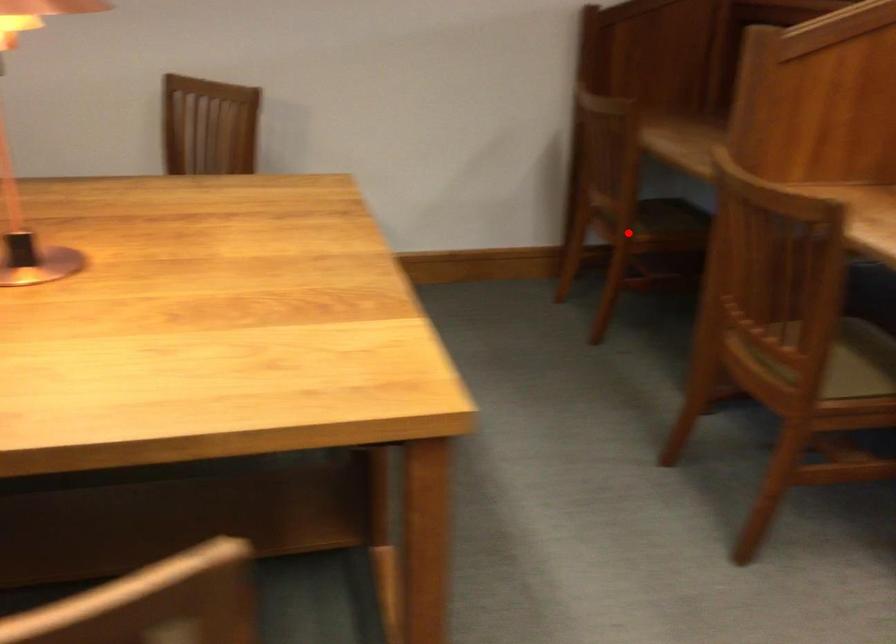
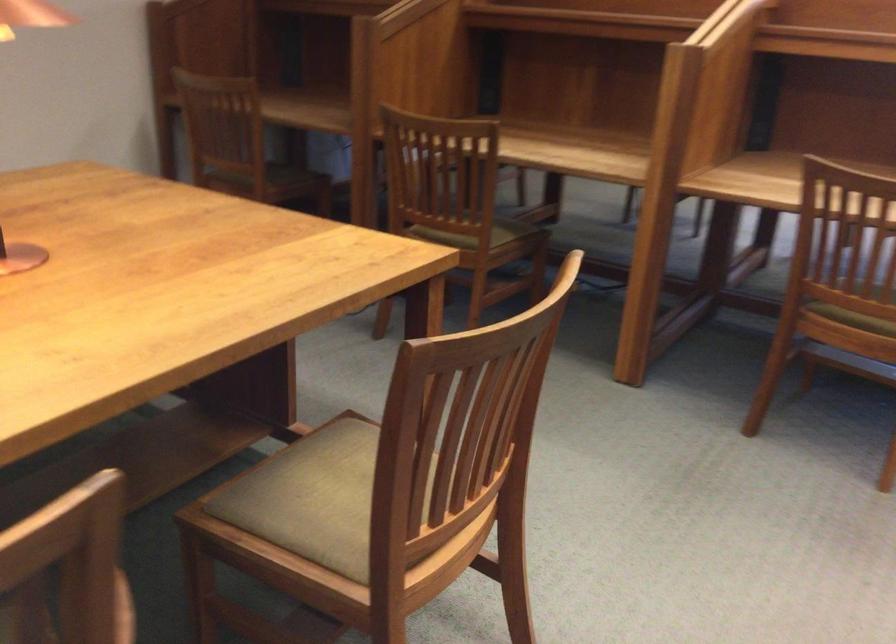
Question: I am providing you with two images of the same scene from different viewpoints. A red point is marked on the first image. Is the red point's position out of view in image 2?

Choices:
 (A) Yes
 (B) No

Answer: (B)